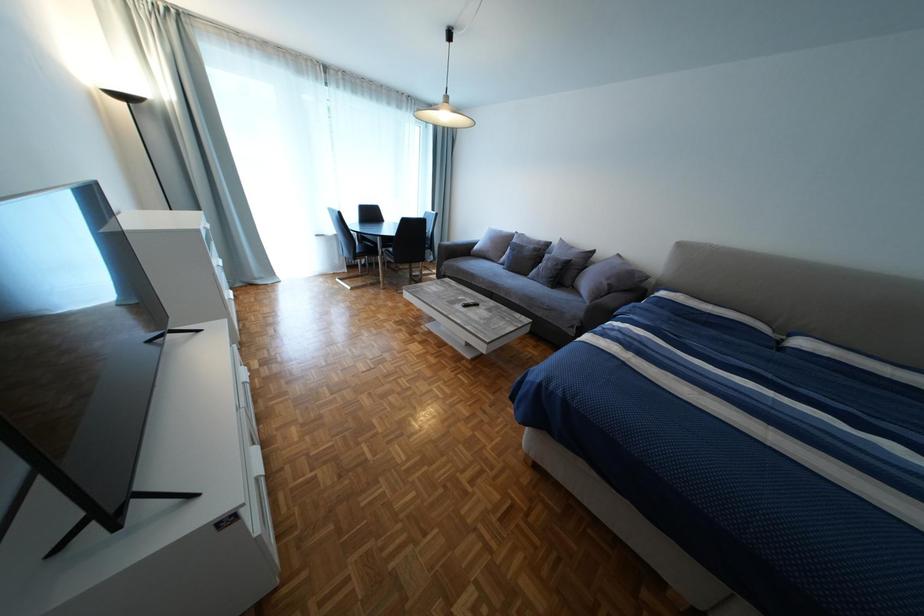
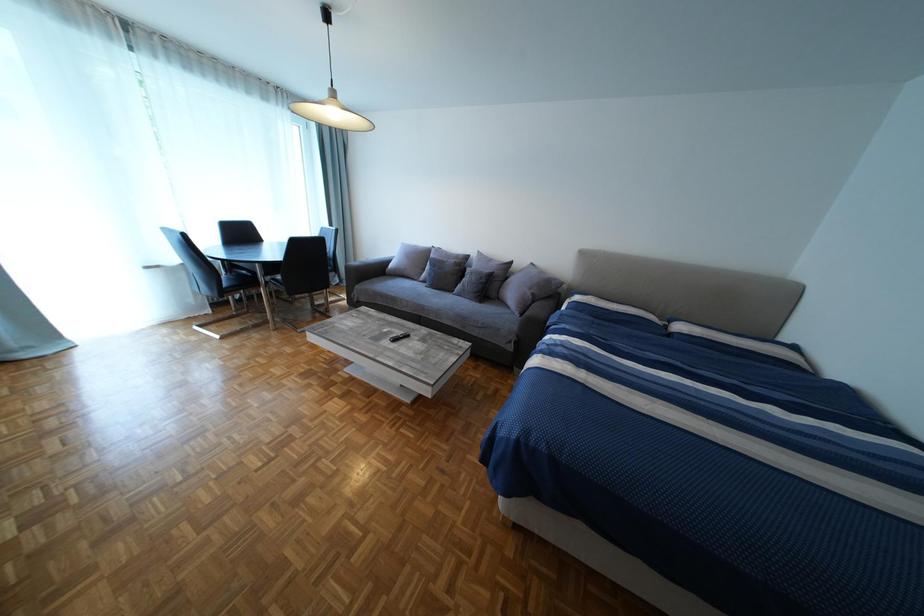
Question: The camera is either moving clockwise (left) or counter-clockwise (right) around the object. The first image is from the beginning of the video and the second image is from the end. Is the camera moving left or right when shooting the video?

Choices:
 (A) Left
 (B) Right

Answer: (A)